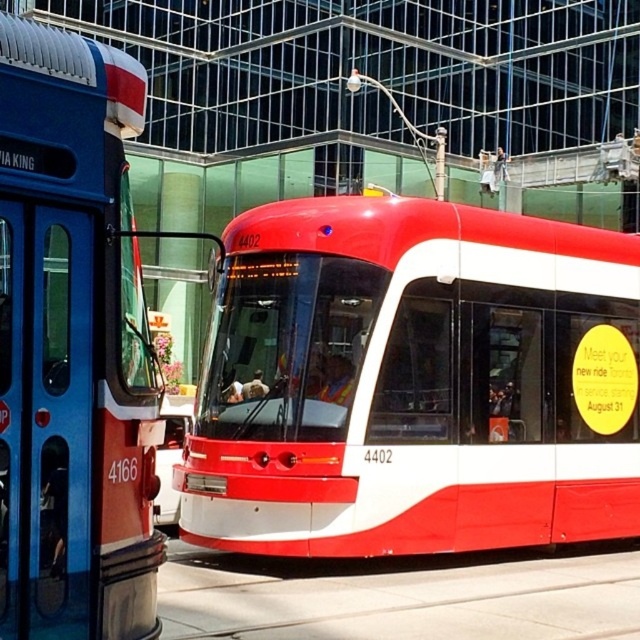
You are a passenger waiting at the station and see the shiny red bus at center and the matte red bus at left. Which bus is closer to you?

The shiny red bus at center is closer to you because it is positioned under the matte red bus at left, indicating it is in front.

What are the coordinates of the shiny red bus at center?

The coordinates of the shiny red bus at center are at point (413, 381).